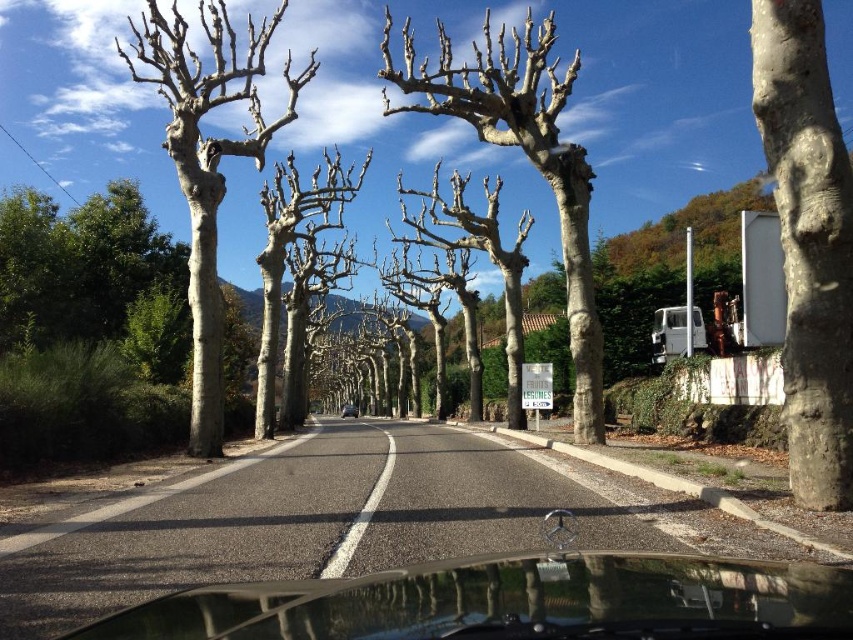
Question: Considering the real-world distances, which object is closest to the bare wood tree at center?

Choices:
 (A) smooth bark tree at center
 (B) transparent glass windshield at center

Answer: (A)

Question: Can you confirm if transparent glass windshield at center is positioned above smooth white tree at center?

Choices:
 (A) no
 (B) yes

Answer: (A)

Question: Which point is closer to the camera?

Choices:
 (A) transparent glass windshield at center
 (B) white asphalt road at center
 (C) metallic silver car at center

Answer: (A)

Question: Is transparent glass windshield at center thinner than smooth bark tree at center?

Choices:
 (A) yes
 (B) no

Answer: (A)

Question: Which point is closer to the camera taking this photo?

Choices:
 (A) (839, 257)
 (B) (332, 554)
 (C) (186, 28)
 (D) (347, 628)

Answer: (D)

Question: Is smooth bark tree at center closer to the viewer compared to white asphalt road at center?

Choices:
 (A) yes
 (B) no

Answer: (B)